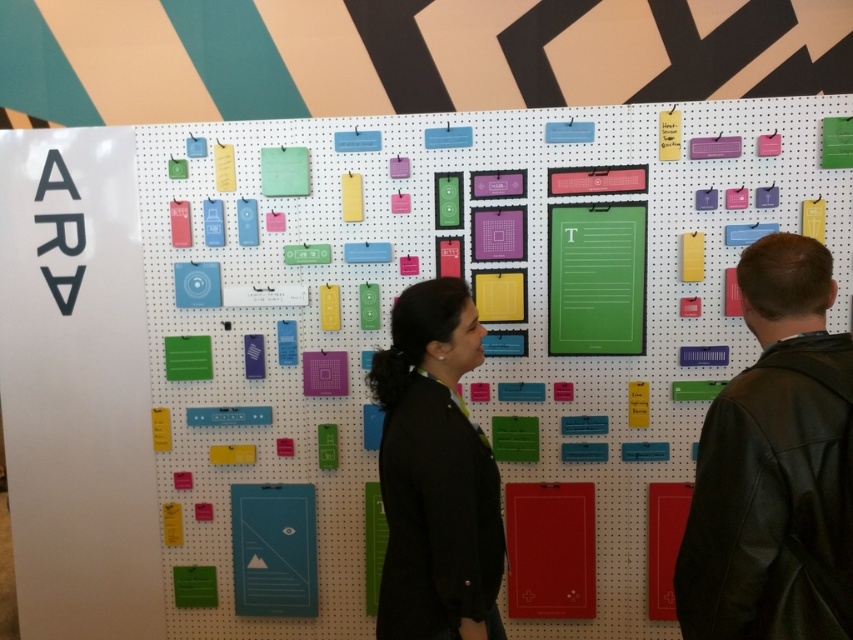
You are a store employee organizing items on the pegboard wall. You need to place a new item at the coordinates point (775, 467). According to the image, what item is already located at that position?

The point (775, 467) corresponds to the black leather jacket at right.

You are organizing a clothing store and need to arrange the black leather jacket at right and the black matte jacket at center. According to the store layout, items to the right are more expensive. Which jacket should you place on the higher shelf to follow the pricing strategy?

The black leather jacket at right should be placed on the higher shelf because it is positioned to the right of the black matte jacket at center, indicating it is more expensive and should be displayed accordingly.